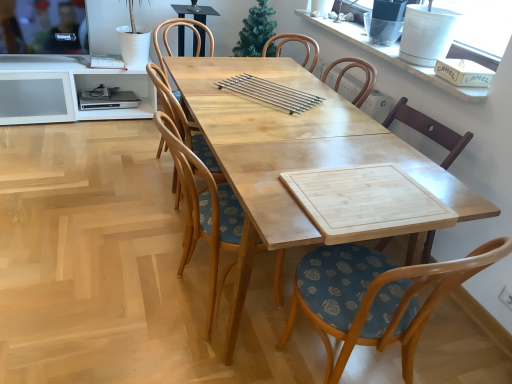
Question: From the image's perspective, is white ceramic vase at upper right below wooden chair with floral cushion at center, which is the first chair in front-to-back order?

Choices:
 (A) yes
 (B) no

Answer: (B)

Question: Is white ceramic vase at upper right positioned with its back to wooden chair with floral cushion at center, which is the first chair in front-to-back order?

Choices:
 (A) yes
 (B) no

Answer: (B)

Question: Is white ceramic vase at upper right bigger than wooden chair with floral cushion at center, which is the first chair in front-to-back order?

Choices:
 (A) no
 (B) yes

Answer: (A)

Question: From a real-world perspective, is white ceramic vase at upper right located higher than wooden chair with floral cushion at center, which is the first chair in front-to-back order?

Choices:
 (A) no
 (B) yes

Answer: (B)

Question: Does white ceramic vase at upper right lie behind wooden chair with floral cushion at center, which is the first chair in front-to-back order?

Choices:
 (A) yes
 (B) no

Answer: (A)

Question: Is white ceramic vase at upper right placed right next to wooden chair with floral cushion at center, placed as the 3th chair when sorted from back to front?

Choices:
 (A) yes
 (B) no

Answer: (B)

Question: Considering the relative sizes of wooden chair with floral cushion at center, which is the first chair in front-to-back order, and white ceramic vase at upper right in the image provided, is wooden chair with floral cushion at center, which is the first chair in front-to-back order, smaller than white ceramic vase at upper right?

Choices:
 (A) no
 (B) yes

Answer: (A)

Question: Is wooden chair with floral cushion at center, which is the first chair in front-to-back order, aimed at white ceramic vase at upper right?

Choices:
 (A) yes
 (B) no

Answer: (B)

Question: Is wooden chair with floral cushion at center, which is the first chair in front-to-back order, at the left side of white ceramic vase at upper right?

Choices:
 (A) no
 (B) yes

Answer: (B)

Question: From a real-world perspective, is wooden chair with floral cushion at center, placed as the 3th chair when sorted from back to front, located higher than white ceramic vase at upper right?

Choices:
 (A) no
 (B) yes

Answer: (A)

Question: From the image's perspective, is wooden chair with floral cushion at center, which is the first chair in front-to-back order, above white ceramic vase at upper right?

Choices:
 (A) yes
 (B) no

Answer: (B)

Question: Is wooden chair with floral cushion at center, placed as the 3th chair when sorted from back to front, at the right side of white ceramic vase at upper right?

Choices:
 (A) yes
 (B) no

Answer: (B)

Question: Considering the relative sizes of light wood table at center and white ceramic vase at upper right in the image provided, is light wood table at center bigger than white ceramic vase at upper right?

Choices:
 (A) no
 (B) yes

Answer: (B)